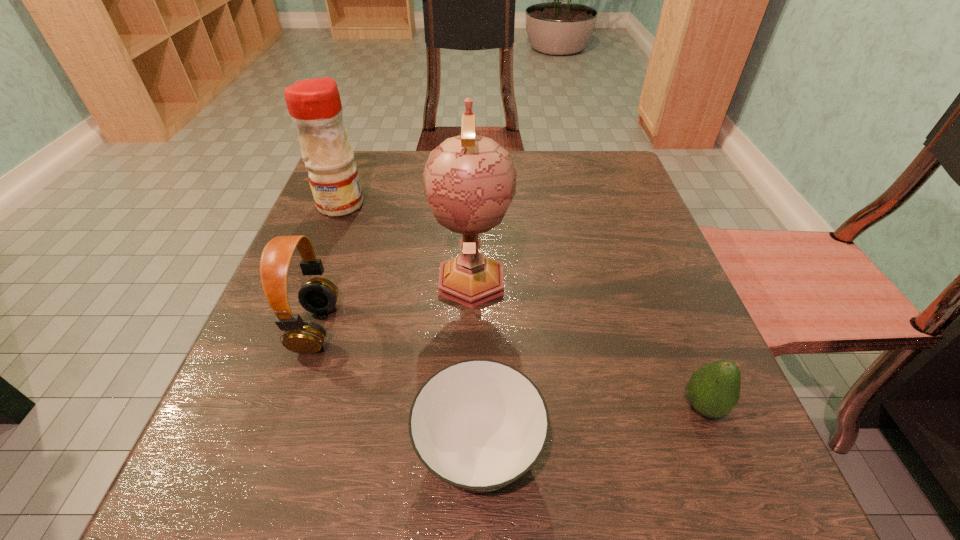
At what (x,y) coordinates should I click in order to perform the action: click on vacant space in between the tallest object and the rightmost object. Please return your answer as a coordinate pair (x, y). This screenshot has width=960, height=540. Looking at the image, I should click on (588, 342).

Identify which object is the third closest to the farthest object. Please provide its 2D coordinates. Your answer should be formatted as a tuple, i.e. [(x, y)], where the tuple contains the x and y coordinates of a point satisfying the conditions above.

[(478, 425)]

Identify the location of object that is the closest to the rightmost object. Image resolution: width=960 pixels, height=540 pixels. (478, 425).

Locate an element on the screen. The width and height of the screenshot is (960, 540). free space that satisfies the following two spatial constraints: 1. on the front-facing side of the globe; 2. on the ear cups of the headset is located at coordinates (470, 328).

Where is `free spot that satisfies the following two spatial constraints: 1. on the ear cups of the rightmost object; 2. on the right side of the headset`? The image size is (960, 540). free spot that satisfies the following two spatial constraints: 1. on the ear cups of the rightmost object; 2. on the right side of the headset is located at coordinates (290, 406).

Identify the location of free space that satisfies the following two spatial constraints: 1. on the front-facing side of the tallest object; 2. on the ear cups of the headset. The width and height of the screenshot is (960, 540). (470, 328).

What are the coordinates of `free space that satisfies the following two spatial constraints: 1. on the ear cups of the soup bowl; 2. on the left side of the third tallest object` in the screenshot? It's located at (274, 451).

Locate an element on the screen. vacant area that satisfies the following two spatial constraints: 1. on the front-facing side of the tallest object; 2. on the ear cups of the third tallest object is located at coordinates (470, 328).

This screenshot has height=540, width=960. What are the coordinates of `vacant point that satisfies the following two spatial constraints: 1. on the ear cups of the avocado; 2. on the right side of the headset` in the screenshot? It's located at (290, 406).

This screenshot has width=960, height=540. What are the coordinates of `vacant space that satisfies the following two spatial constraints: 1. on the front side of the farthest object; 2. on the left side of the rightmost object` in the screenshot? It's located at (261, 406).